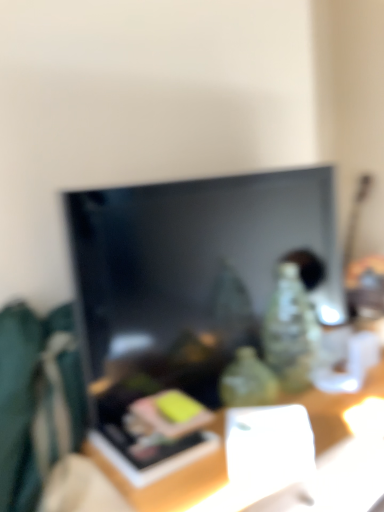
Question: Do you think black glossy tv at center is within wooden table at center, or outside of it?

Choices:
 (A) inside
 (B) outside

Answer: (B)

Question: From the image's perspective, is black glossy tv at center above or below wooden table at center?

Choices:
 (A) above
 (B) below

Answer: (A)

Question: Considering the positions of black glossy tv at center and wooden table at center in the image, is black glossy tv at center taller or shorter than wooden table at center?

Choices:
 (A) short
 (B) tall

Answer: (B)

Question: From a real-world perspective, is wooden table at center above or below black glossy tv at center?

Choices:
 (A) above
 (B) below

Answer: (B)

Question: From their relative heights in the image, would you say wooden table at center is taller or shorter than black glossy tv at center?

Choices:
 (A) short
 (B) tall

Answer: (A)

Question: Considering the positions of wooden table at center and black glossy tv at center in the image, is wooden table at center wider or thinner than black glossy tv at center?

Choices:
 (A) wide
 (B) thin

Answer: (A)

Question: Visually, is wooden table at center positioned to the left or to the right of black glossy tv at center?

Choices:
 (A) right
 (B) left

Answer: (A)